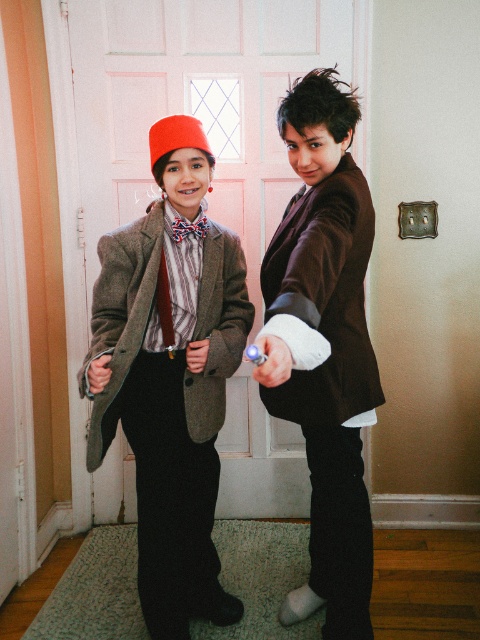
You are a fashion designer observing the two items in the scene. Which item, the matte brown blazer at center or the matte wool tie at center, would you say is taller?

The matte brown blazer at center is taller than the matte wool tie at center.

You are standing in front of the white door with a small window at the top. There is a point marked at coordinates (189, 227). What object is located at that point?

The red satin tie at center is located at point (189, 227).

You are trying to decide which tie to wear for an event. Both the red satin tie at center and the matte wool tie at center are in front of you. If you want to choose the one on the right side, which one should you pick?

The matte wool tie at center is on the right side, so you should pick the matte wool tie at center.